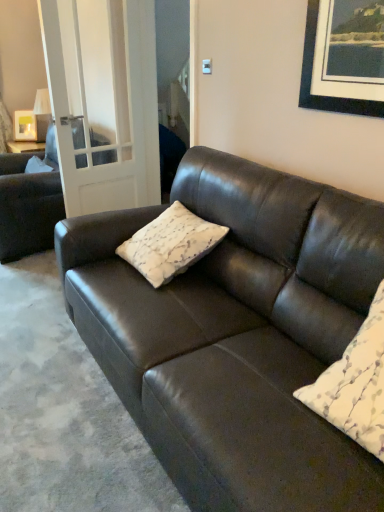
Question: From the image's perspective, is matte black couch at center, the 2th studio couch positioned from the left, under clear glass door at left?

Choices:
 (A) yes
 (B) no

Answer: (A)

Question: From the image's perspective, is matte black couch at center, which is the first studio couch in right-to-left order, located above clear glass door at left?

Choices:
 (A) no
 (B) yes

Answer: (A)

Question: Is the depth of matte black couch at center, which ranks as the 1th studio couch in front-to-back order, greater than that of clear glass door at left?

Choices:
 (A) yes
 (B) no

Answer: (B)

Question: From a real-world perspective, is matte black couch at center, the 2th studio couch positioned from the left, on top of clear glass door at left?

Choices:
 (A) yes
 (B) no

Answer: (B)

Question: Is matte black couch at center, the 2th studio couch positioned from the left, to the right of clear glass door at left from the viewer's perspective?

Choices:
 (A) no
 (B) yes

Answer: (B)

Question: Considering the relative sizes of matte black couch at center, which ranks as the 1th studio couch in front-to-back order, and clear glass door at left in the image provided, is matte black couch at center, which ranks as the 1th studio couch in front-to-back order, shorter than clear glass door at left?

Choices:
 (A) no
 (B) yes

Answer: (B)

Question: Is matte black couch at center, positioned as the 2th studio couch in back-to-front order, looking in the opposite direction of white textured pillow at center, acting as the first pillow starting from the front?

Choices:
 (A) no
 (B) yes

Answer: (B)

Question: From the image's perspective, is matte black couch at center, which is the first studio couch in right-to-left order, over white textured pillow at center, acting as the 2th pillow starting from the back?

Choices:
 (A) no
 (B) yes

Answer: (B)

Question: Is matte black couch at center, the 2th studio couch positioned from the left, not within white textured pillow at center, acting as the 2th pillow starting from the back?

Choices:
 (A) no
 (B) yes

Answer: (B)

Question: Is matte black couch at center, which is the first studio couch in right-to-left order, further to camera compared to white textured pillow at center, the 2th pillow in the left-to-right sequence?

Choices:
 (A) yes
 (B) no

Answer: (B)

Question: Considering the relative sizes of matte black couch at center, which ranks as the 1th studio couch in front-to-back order, and white textured pillow at center, acting as the first pillow starting from the front, in the image provided, is matte black couch at center, which ranks as the 1th studio couch in front-to-back order, wider than white textured pillow at center, acting as the first pillow starting from the front,?

Choices:
 (A) yes
 (B) no

Answer: (A)

Question: From a real-world perspective, does matte black couch at center, the 2th studio couch positioned from the left, stand above white textured pillow at center, the 2th pillow in the left-to-right sequence?

Choices:
 (A) yes
 (B) no

Answer: (B)

Question: From a real-world perspective, is white textured pillow at center, arranged as the 2th pillow when viewed from the right, on clear glass door at left?

Choices:
 (A) no
 (B) yes

Answer: (A)